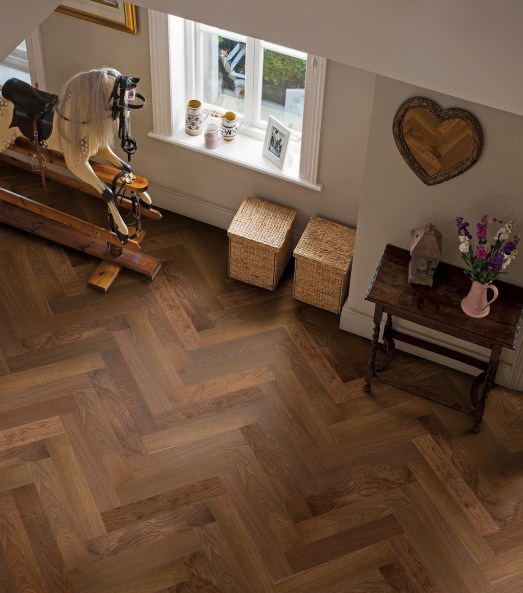
Locate an element on the screen. The height and width of the screenshot is (593, 523). white picture frame is located at coordinates (277, 158).